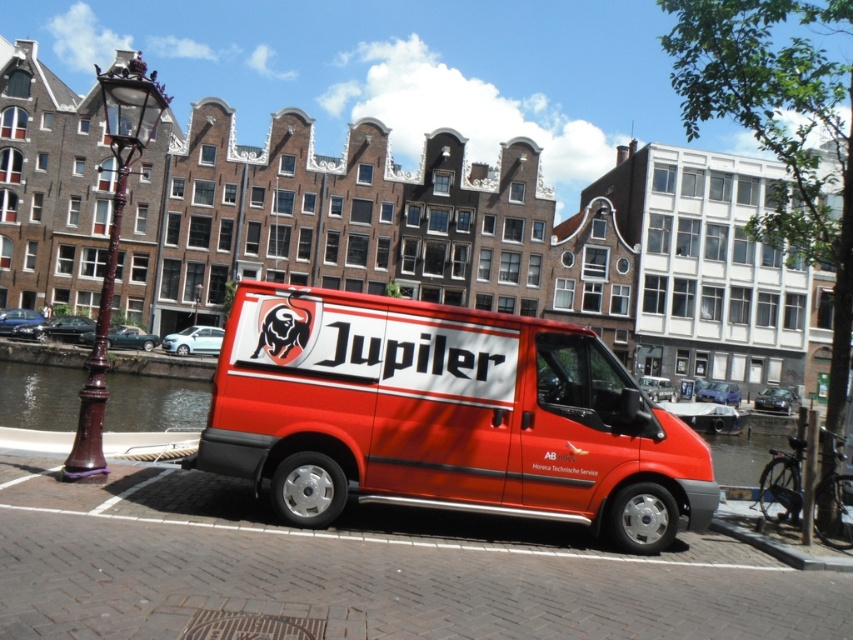
You are standing at the center of the image and want to find the bronze lamppost at left. In which direction should you look to see it?

The bronze lamppost at left is located at point (112, 246), which means it is to the left and slightly below the center of the image. You should look to your left and down to see it.

You are a photographer planning to take a photo of the shiny red van at center and the transparent water at left. Based on their sizes in the image, which object would appear narrower in the photo?

The shiny red van at center is thinner than transparent water at left, so it would appear narrower in the photo.

Consider the image. You are a photographer standing in front of the red van. You notice a bronze lamppost at left and transparent water at left. Which object is taller?

The bronze lamppost at left is much taller than the transparent water at left according to the description.